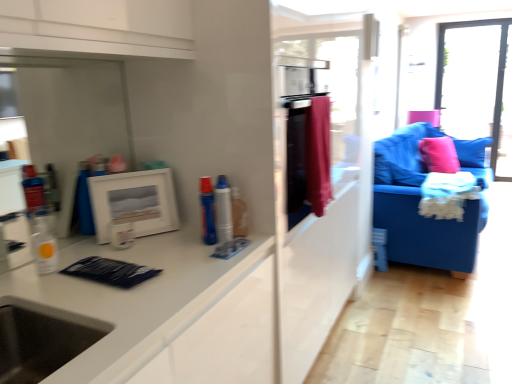
Question: From the image's perspective, relative to transparent plastic bottle at left, placed as the 3th toiletry when sorted from right to left, is pink fabric pillow at right above or below?

Choices:
 (A) below
 (B) above

Answer: (B)

Question: Is pink fabric pillow at right taller or shorter than transparent plastic bottle at left, acting as the 1th toiletry starting from the left?

Choices:
 (A) short
 (B) tall

Answer: (B)

Question: Estimate the real-world distances between objects in this image. Which object is farther from the white matte picture frame at upper left?

Choices:
 (A) pink fabric pillow at right
 (B) velvet red curtain at center
 (C) transparent glass window at upper right
 (D) blue fabric couch at right
 (E) transparent plastic bottle at left, acting as the 1th toiletry starting from the left

Answer: (C)

Question: Which is farther from the blue plastic spray can at center, the third toiletry in the left-to-right sequence?

Choices:
 (A) white matte picture frame at upper left
 (B) transparent plastic bottle at left, placed as the 3th toiletry when sorted from right to left
 (C) blue fabric couch at right
 (D) blue plastic toothpaste at center, which appears as the 2th toiletry when viewed from the right
 (E) velvet red curtain at center

Answer: (C)